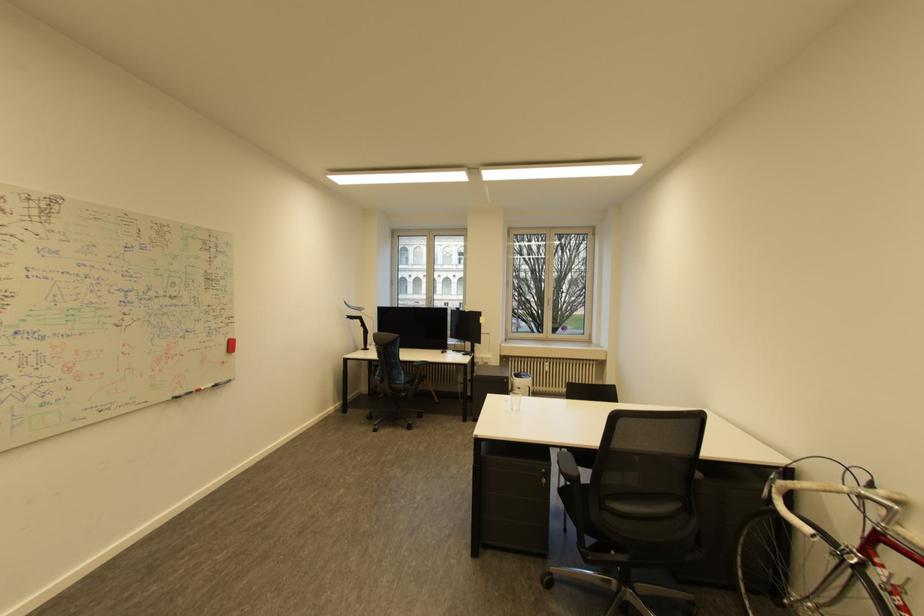
Describe the element at coordinates (771, 483) in the screenshot. I see `a bicycle brake lever` at that location.